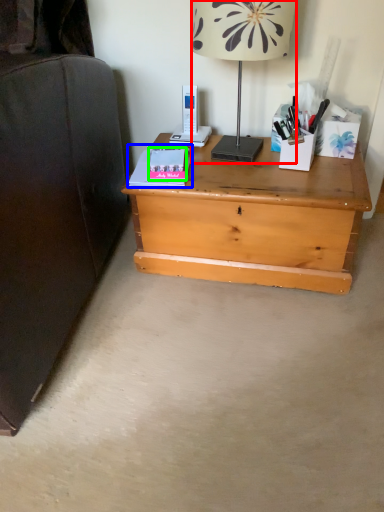
Question: Which object is positioned closest to lamp (highlighted by a red box)? Select from paperback book (highlighted by a blue box) and paperback book (highlighted by a green box).

Choices:
 (A) paperback book
 (B) paperback book

Answer: (B)